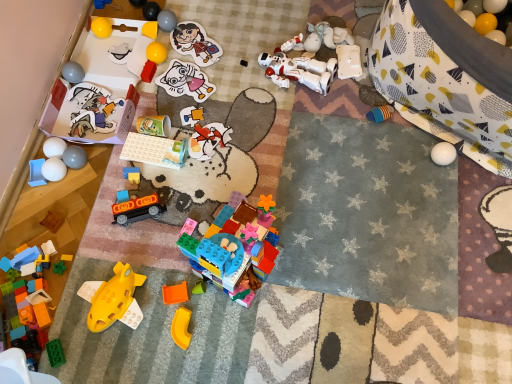
Identify the location of free space between yellow matte plastic arch at center, which appears as the 21th toy when viewed from the left, and orange matte train at center, which is the twelfth toy in right-to-left order. (158, 270).